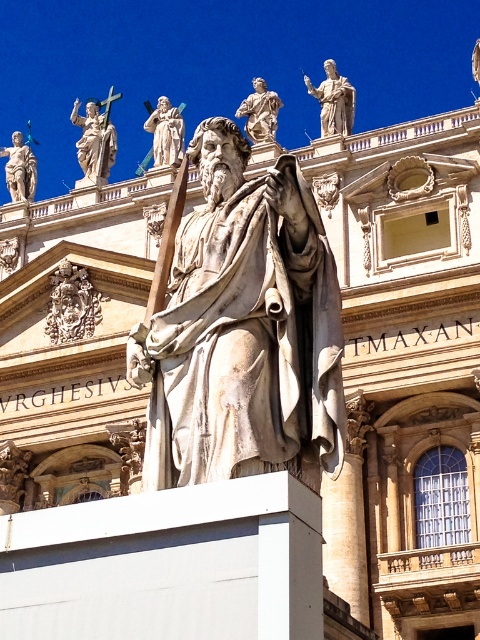
Does white marble statue at center have a lesser height compared to matte stone statue at upper center?

Correct, white marble statue at center is not as tall as matte stone statue at upper center.

Which is in front, point (175, 232) or point (180, 118)?

Point (175, 232)

This screenshot has height=640, width=480. Identify the location of white marble statue at center. (241, 326).

Is the position of carved stone relief at upper left more distant than that of white marble statue at upper center?

Yes, it is behind white marble statue at upper center.

The image size is (480, 640). Find the location of `carved stone relief at upper left`. carved stone relief at upper left is located at coordinates (72, 305).

Is polished marble statue at upper left positioned behind matte gray statue at upper left?

No.

Is point (86, 116) positioned after point (14, 186)?

Yes.

Locate an element on the screen. polished marble statue at upper left is located at coordinates (96, 138).